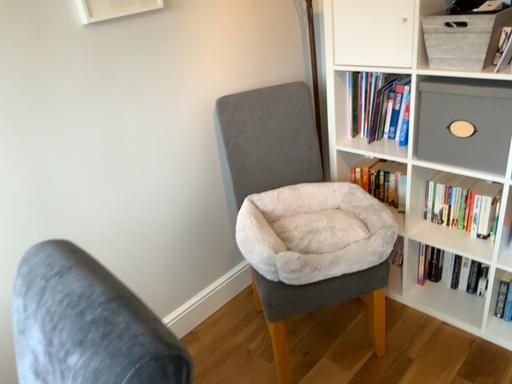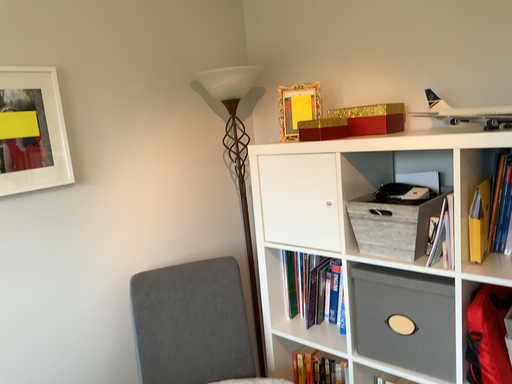
Question: How did the camera likely rotate when shooting the video?

Choices:
 (A) rotated upward
 (B) rotated downward

Answer: (A)